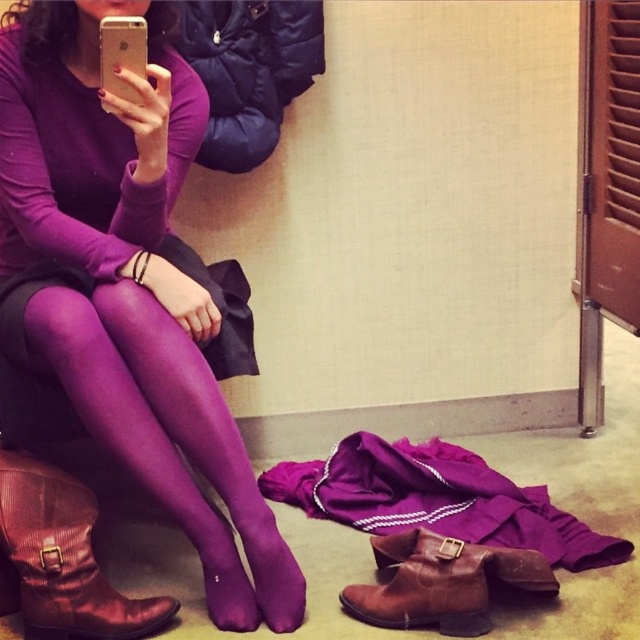
Between matte purple tights at lower center and brown suede boot at lower center, which one is positioned higher?

matte purple tights at lower center is above.

Can you confirm if matte purple tights at lower center is positioned to the left of brown suede boot at lower center?

Correct, you'll find matte purple tights at lower center to the left of brown suede boot at lower center.

Describe the element at coordinates (128, 284) in the screenshot. I see `matte purple tights at lower center` at that location.

The image size is (640, 640). What are the coordinates of `matte purple tights at lower center` in the screenshot? It's located at (128, 284).

Is brown leather boot at lower left in front of brown suede boot at lower center?

Yes, brown leather boot at lower left is in front of brown suede boot at lower center.

Where is `brown leather boot at lower left`? brown leather boot at lower left is located at coordinates (60, 561).

I want to click on brown leather boot at lower left, so click(60, 561).

At what (x,y) coordinates should I click in order to perform the action: click on brown leather boot at lower left. Please return your answer as a coordinate pair (x, y). Looking at the image, I should click on (60, 561).

From the picture: Is matte purple tights at lower center positioned in front of brown leather boot at lower left?

That is True.

Between point (266, 616) and point (61, 524), which one is positioned behind?

The point (266, 616) is more distant.

Where is `matte purple tights at lower center`? The image size is (640, 640). matte purple tights at lower center is located at coordinates (128, 284).